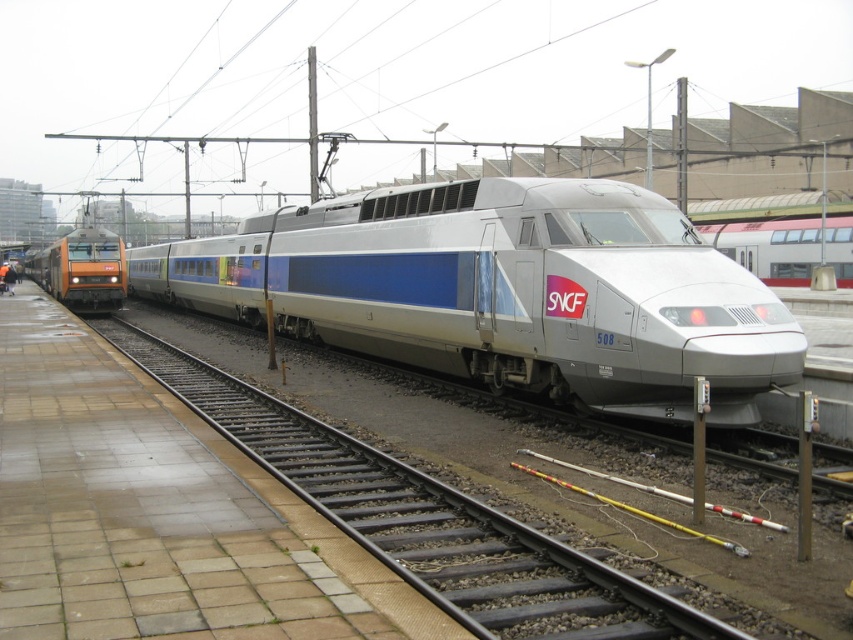
You are a railway engineer who needs to determine which train is shorter between the silver metallic bullet train at center and the orange metallic locomotive at left. Based on the scene, which one is shorter?

The silver metallic bullet train at center is shorter than the orange metallic locomotive at left according to the description.